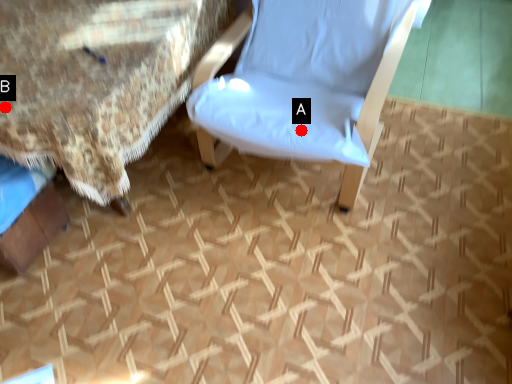
Question: Two points are circled on the image, labeled by A and B beside each circle. Which point is further to the camera?

Choices:
 (A) A is further
 (B) B is further

Answer: (A)